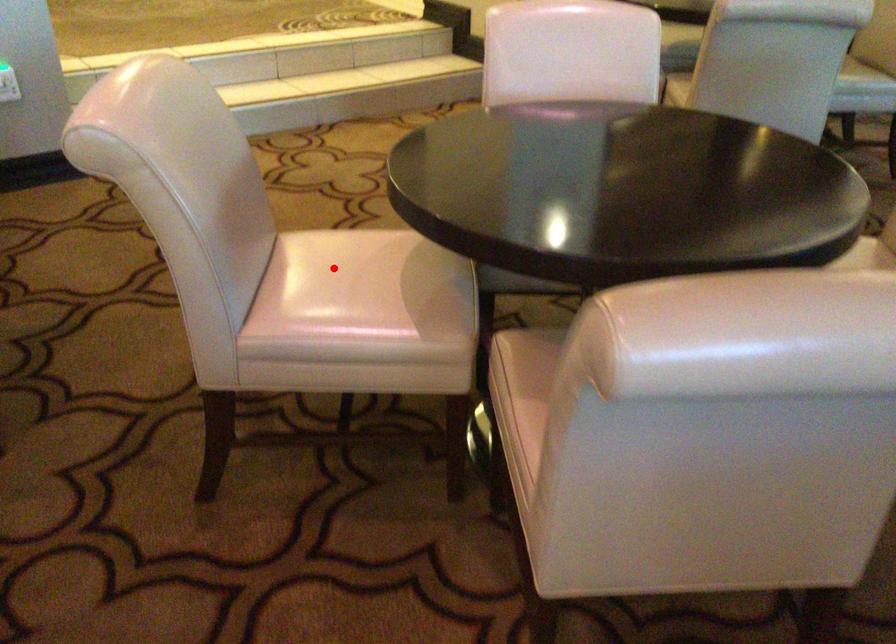
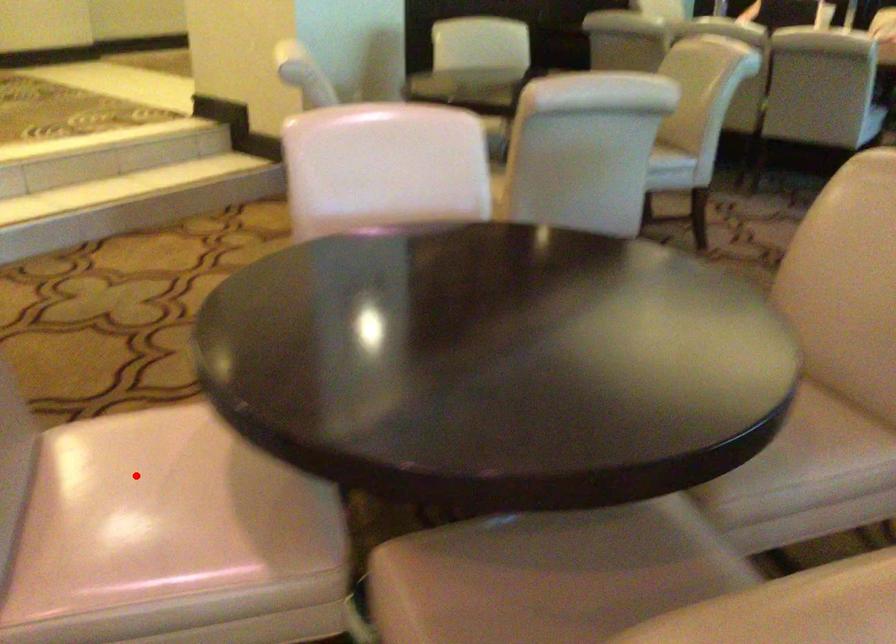
I am providing you with two images of the same scene from different viewpoints. A red point is marked on the first image and another point is marked on the second image. Do the highlighted points in image1 and image2 indicate the same real-world spot?

Yes